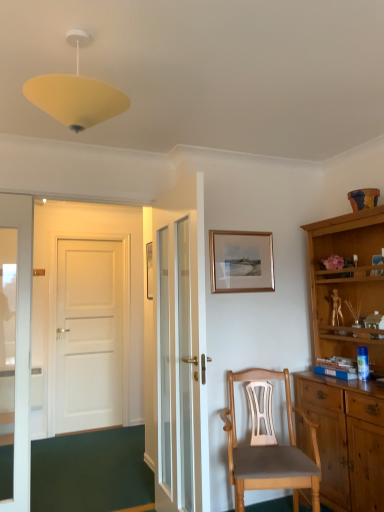
Question: Does gold metallic picture frame at upper center contain yellow matte/soft plastic lampshade at upper center?

Choices:
 (A) yes
 (B) no

Answer: (B)

Question: Is gold metallic picture frame at upper center at the right side of yellow matte/soft plastic lampshade at upper center?

Choices:
 (A) no
 (B) yes

Answer: (B)

Question: Does gold metallic picture frame at upper center have a larger size compared to yellow matte/soft plastic lampshade at upper center?

Choices:
 (A) yes
 (B) no

Answer: (B)

Question: Is gold metallic picture frame at upper center facing towards yellow matte/soft plastic lampshade at upper center?

Choices:
 (A) yes
 (B) no

Answer: (B)

Question: Is gold metallic picture frame at upper center to the left of yellow matte/soft plastic lampshade at upper center from the viewer's perspective?

Choices:
 (A) yes
 (B) no

Answer: (B)

Question: From the image's perspective, is gold metallic picture frame at upper center located above yellow matte/soft plastic lampshade at upper center?

Choices:
 (A) yes
 (B) no

Answer: (B)

Question: Is gold metallic picture frame at upper center directly adjacent to white glass door at center?

Choices:
 (A) yes
 (B) no

Answer: (B)

Question: From a real-world perspective, does gold metallic picture frame at upper center sit lower than white glass door at center?

Choices:
 (A) yes
 (B) no

Answer: (B)

Question: Does gold metallic picture frame at upper center have a greater height compared to white glass door at center?

Choices:
 (A) yes
 (B) no

Answer: (B)

Question: Does gold metallic picture frame at upper center have a lesser height compared to white glass door at center?

Choices:
 (A) yes
 (B) no

Answer: (A)

Question: Is gold metallic picture frame at upper center oriented towards white glass door at center?

Choices:
 (A) yes
 (B) no

Answer: (B)

Question: Is gold metallic picture frame at upper center to the right of white glass door at center from the viewer's perspective?

Choices:
 (A) yes
 (B) no

Answer: (A)

Question: Is white glass door at center further to the viewer compared to gold metallic picture frame at upper center?

Choices:
 (A) yes
 (B) no

Answer: (B)